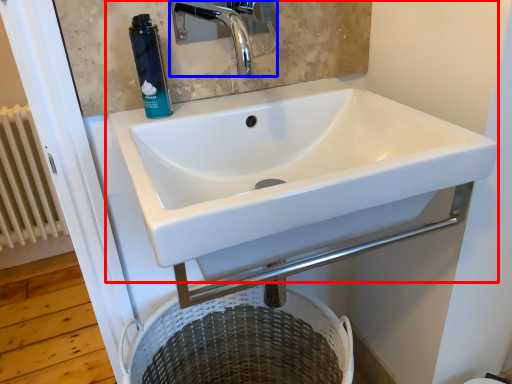
Question: Which object is closer to the camera taking this photo, sink (highlighted by a red box) or tap (highlighted by a blue box)?

Choices:
 (A) sink
 (B) tap

Answer: (A)